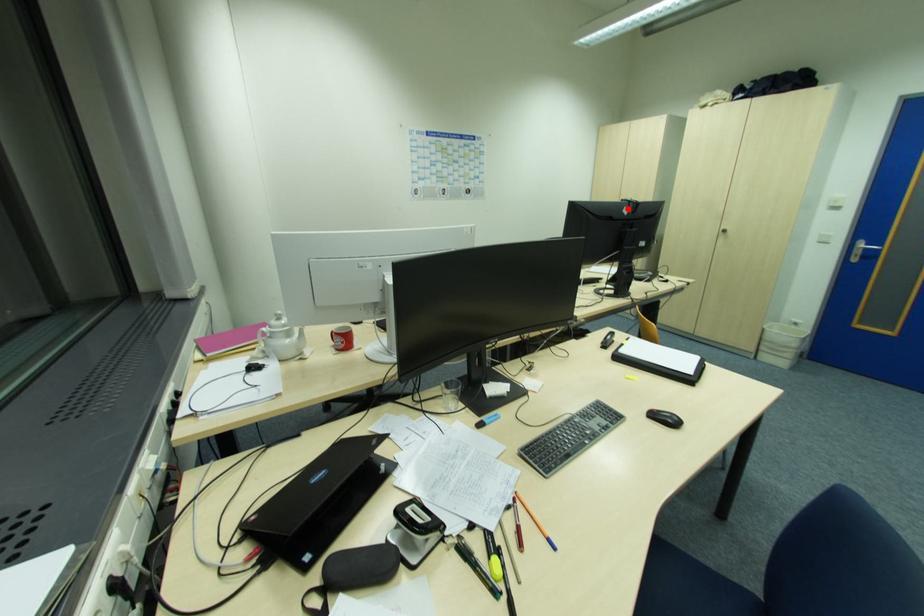
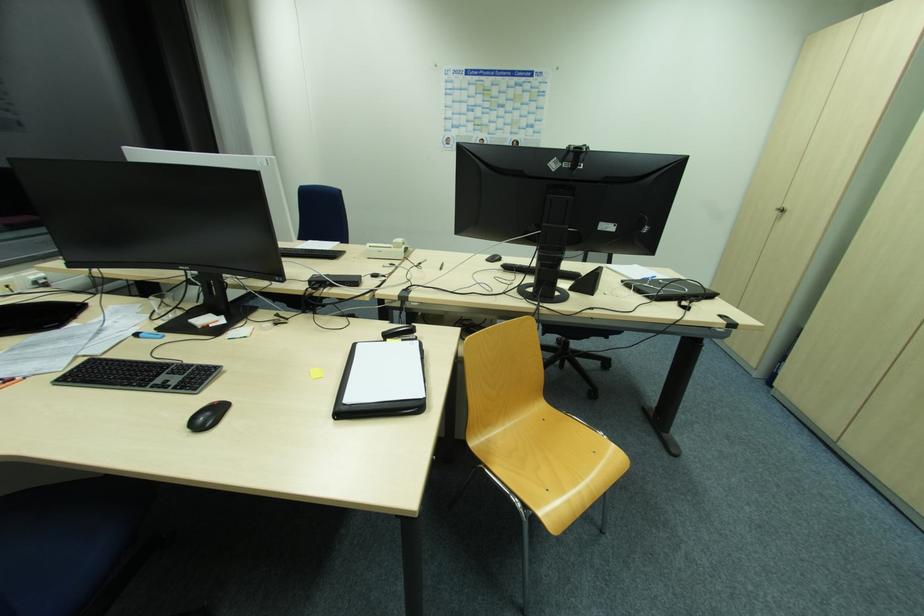
In the second image, find the point that corresponds to the highlighted location in the first image.

(557, 159)